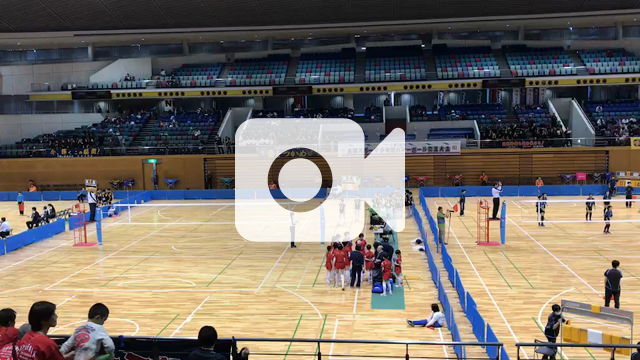
Where is `wall`? wall is located at coordinates (54, 172), (429, 169), (620, 165).